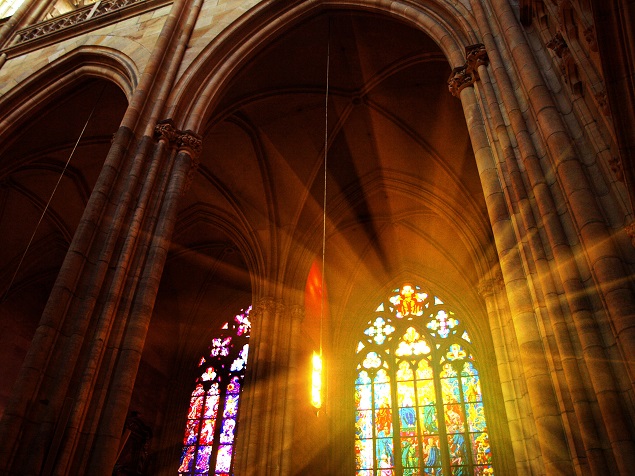
At what (x,y) coordinates should I click in order to perform the action: click on ornate railing top left corner. Please return your answer as a coordinate pair (x, y). The width and height of the screenshot is (635, 476). Looking at the image, I should click on 35,37, 72,17.